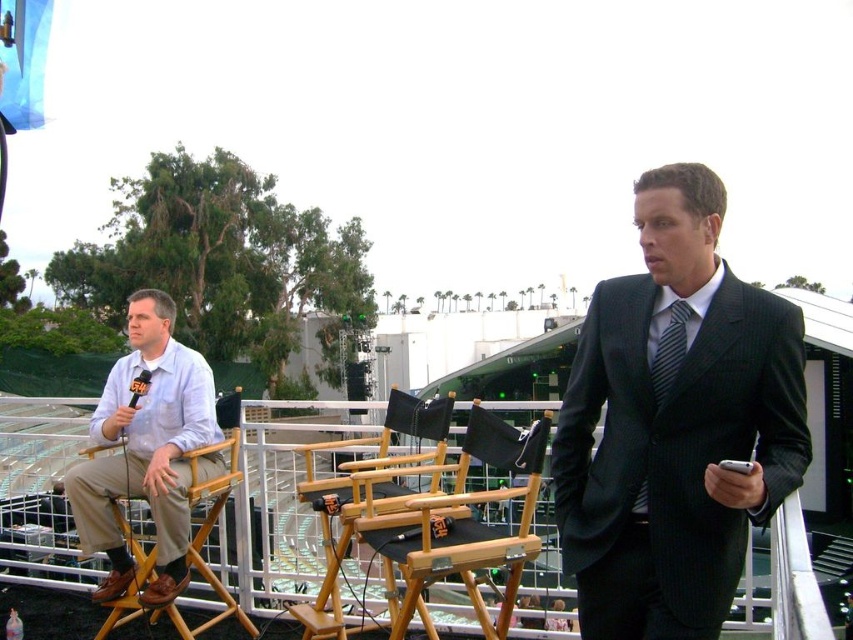
Is black fabric director's chair at center further to the viewer compared to wooden director's chair at left?

No, black fabric director's chair at center is in front of wooden director's chair at left.

This screenshot has width=853, height=640. What are the coordinates of `black fabric director's chair at center` in the screenshot? It's located at (460, 524).

At what (x,y) coordinates should I click in order to perform the action: click on black fabric director's chair at center. Please return your answer as a coordinate pair (x, y). Looking at the image, I should click on (460, 524).

Which is more to the left, dark gray pinstripe suit at center or dark gray striped tie at center?

From the viewer's perspective, dark gray striped tie at center appears more on the left side.

Find the location of a particular element. The width and height of the screenshot is (853, 640). dark gray pinstripe suit at center is located at coordinates (675, 422).

Identify the location of dark gray pinstripe suit at center. This screenshot has width=853, height=640. (675, 422).

Looking at this image, is black fabric director's chair at center in front of dark gray striped tie at center?

No, it is not.

Between black fabric director's chair at center and dark gray striped tie at center, which one is positioned lower?

black fabric director's chair at center is below.

Does point (459, 541) come farther from viewer compared to point (654, 376)?

Yes, it is.

This screenshot has width=853, height=640. I want to click on black fabric director's chair at center, so click(x=460, y=524).